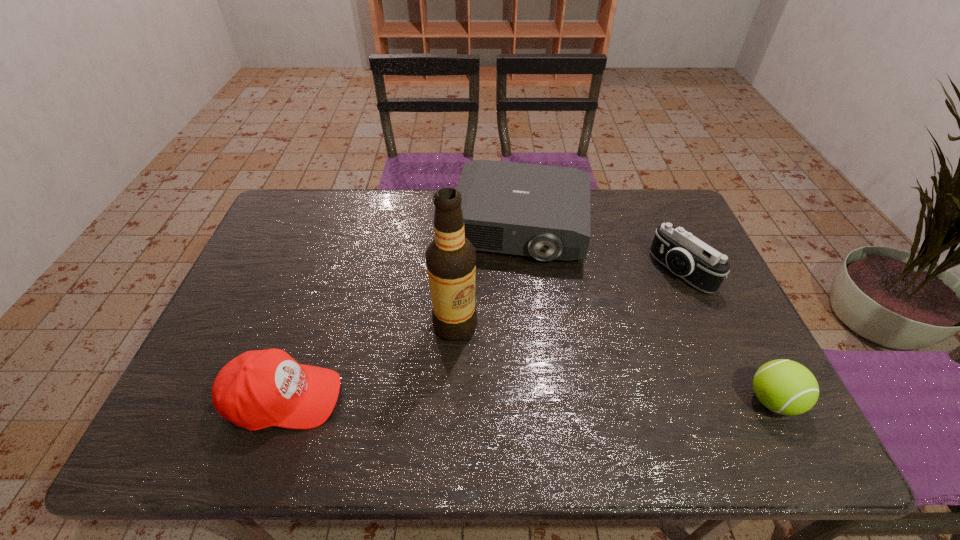
You are a GUI agent. You are given a task and a screenshot of the screen. Output one action in this format:
    pyautogui.click(x=<x>, y=<y>)
    Task: Click on the camera that is at the right edge
    
    Given the screenshot: What is the action you would take?
    pyautogui.click(x=700, y=265)

Identify the location of object that is at the near left corner. point(258,389).

Locate an element on the screen. This screenshot has width=960, height=540. object located at the near right corner is located at coordinates (786, 387).

At what (x,y) coordinates should I click in order to perform the action: click on vacant space at the far edge. Please return your answer as a coordinate pair (x, y). The width and height of the screenshot is (960, 540). Looking at the image, I should click on (372, 232).

Identify the location of free space at the near edge of the desktop. (671, 403).

Locate an element on the screen. Image resolution: width=960 pixels, height=540 pixels. vacant area at the left edge is located at coordinates coord(279,311).

What are the coordinates of `blank space at the right edge of the desktop` in the screenshot? It's located at (747, 358).

Where is `vacant space at the near right corner`? vacant space at the near right corner is located at coordinates (719, 409).

Locate an element on the screen. Image resolution: width=960 pixels, height=540 pixels. vacant area that lies between the tallest object and the baseball cap is located at coordinates (370, 361).

At what (x,y) coordinates should I click in order to perform the action: click on free space between the third nearest object and the camera. Please return your answer as a coordinate pair (x, y). Looking at the image, I should click on (568, 298).